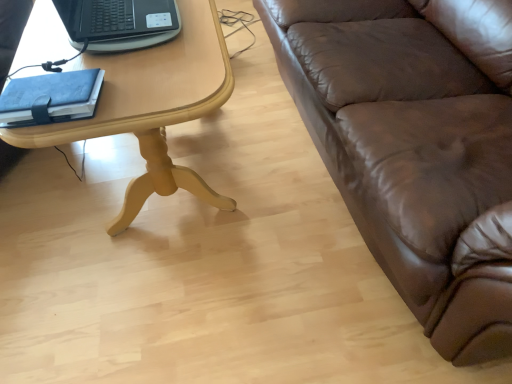
This screenshot has height=384, width=512. I want to click on free space between blue leather notebook at left and black plastic laptop at upper left, so click(x=110, y=70).